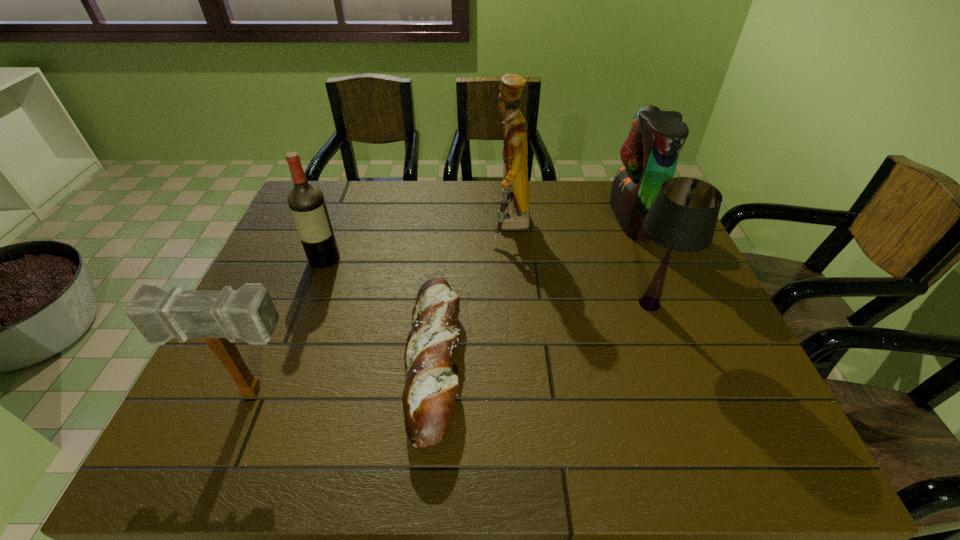
I want to click on nutcracker located in the far edge section of the desktop, so tap(514, 213).

Locate an element on the screen. The width and height of the screenshot is (960, 540). parrot that is at the far edge is located at coordinates (650, 153).

Find the location of `object located in the near edge section of the desktop`. object located in the near edge section of the desktop is located at coordinates (430, 392).

You are a GUI agent. You are given a task and a screenshot of the screen. Output one action in this format:
    pyautogui.click(x=<x>, y=<y>)
    Task: Click on the liquor located at the left edge
    This screenshot has height=540, width=960.
    Given the screenshot: What is the action you would take?
    pyautogui.click(x=306, y=202)

Locate an element on the screen. mallet positioned at the left edge is located at coordinates point(220,317).

Where is `parrot that is at the right edge`? The image size is (960, 540). parrot that is at the right edge is located at coordinates (650, 153).

This screenshot has width=960, height=540. What are the coordinates of `lampshade situated at the right edge` in the screenshot? It's located at (683, 217).

The width and height of the screenshot is (960, 540). I want to click on object at the far right corner, so click(x=650, y=153).

Find the location of a particular element. vacant area at the far edge is located at coordinates coord(614,221).

You are a GUI agent. You are given a task and a screenshot of the screen. Output one action in this format:
    pyautogui.click(x=<x>, y=<y>)
    Task: Click on the vacant area at the near edge
    This screenshot has height=540, width=960.
    Given the screenshot: What is the action you would take?
    pyautogui.click(x=254, y=456)